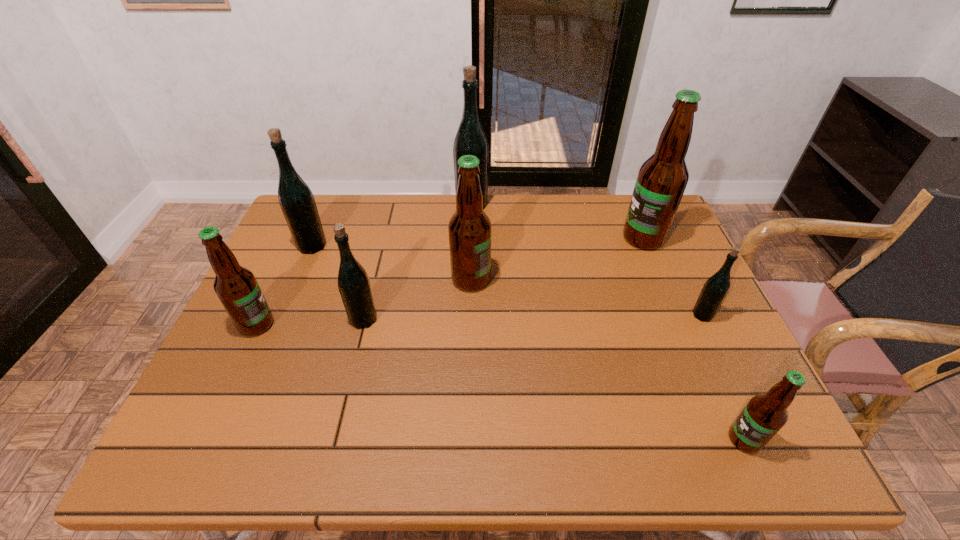
Locate an element on the screen. The height and width of the screenshot is (540, 960). vacant space located on the label of the leftmost brown beer bottle is located at coordinates (420, 325).

The image size is (960, 540). In order to click on vacant space situated on the front of the sixth beer bottle from right to left in this screenshot , I will do `click(349, 375)`.

You are a GUI agent. You are given a task and a screenshot of the screen. Output one action in this format:
    pyautogui.click(x=<x>, y=<y>)
    Task: Click on the vacant region located on the label of the nearest beer bottle
    This screenshot has width=960, height=540.
    Given the screenshot: What is the action you would take?
    pyautogui.click(x=699, y=439)

This screenshot has height=540, width=960. Find the location of `blank space located 0.300m on the label of the nearest beer bottle`. blank space located 0.300m on the label of the nearest beer bottle is located at coordinates (581, 439).

The height and width of the screenshot is (540, 960). In order to click on vacant area located 0.300m on the label of the nearest beer bottle in this screenshot , I will do `click(581, 439)`.

Identify the location of vacant region located 0.340m on the back of the rightmost green beer bottle. (660, 228).

The image size is (960, 540). I want to click on object that is at the near edge, so click(764, 415).

What are the coordinates of `object located at the far left corner` in the screenshot? It's located at (296, 200).

Where is `object that is at the far right corner`? Image resolution: width=960 pixels, height=540 pixels. object that is at the far right corner is located at coordinates (661, 181).

The width and height of the screenshot is (960, 540). I want to click on object positioned at the near right corner, so click(764, 415).